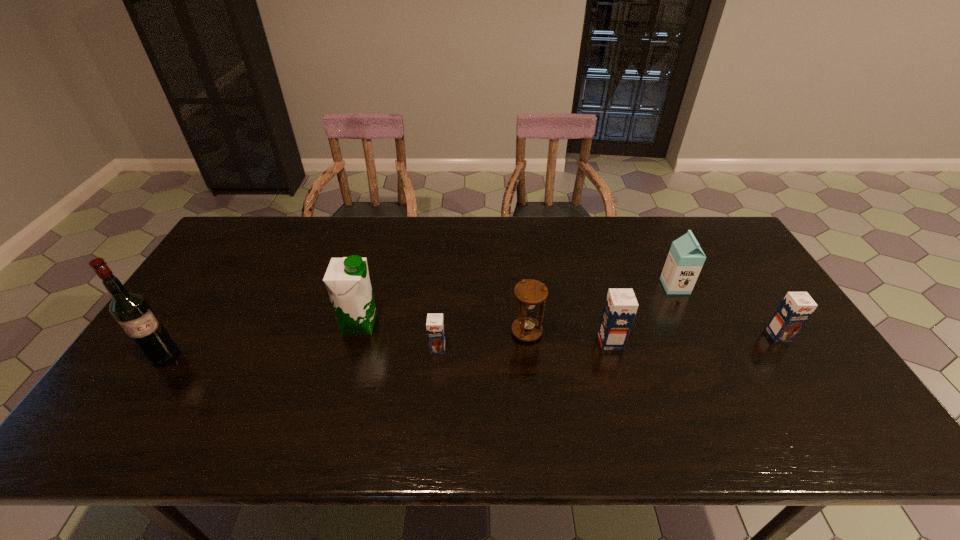
What are the coordinates of `free space that satisfies the following two spatial constraints: 1. on the front-facing side of the sixth object from right to left; 2. on the back side of the fourth object from left to right` in the screenshot? It's located at (357, 332).